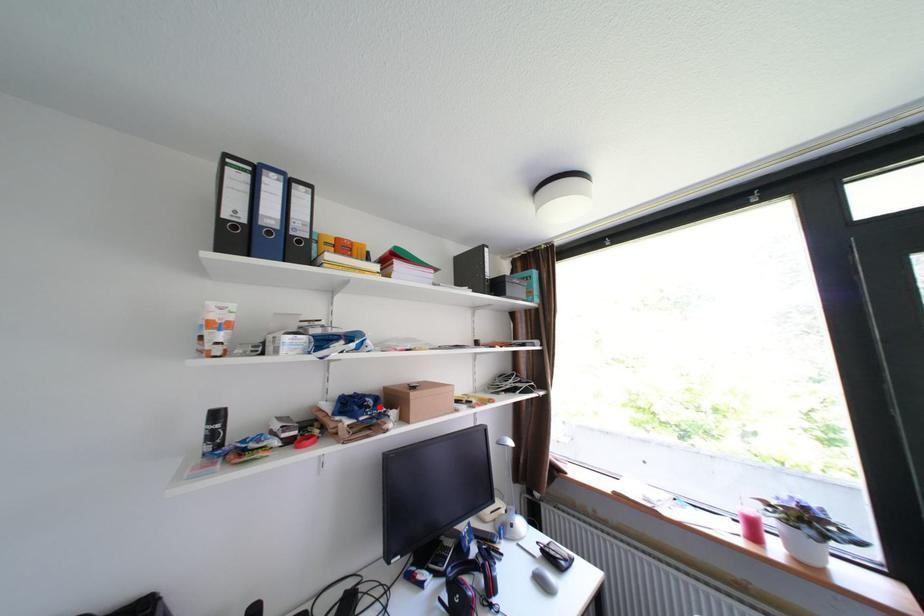
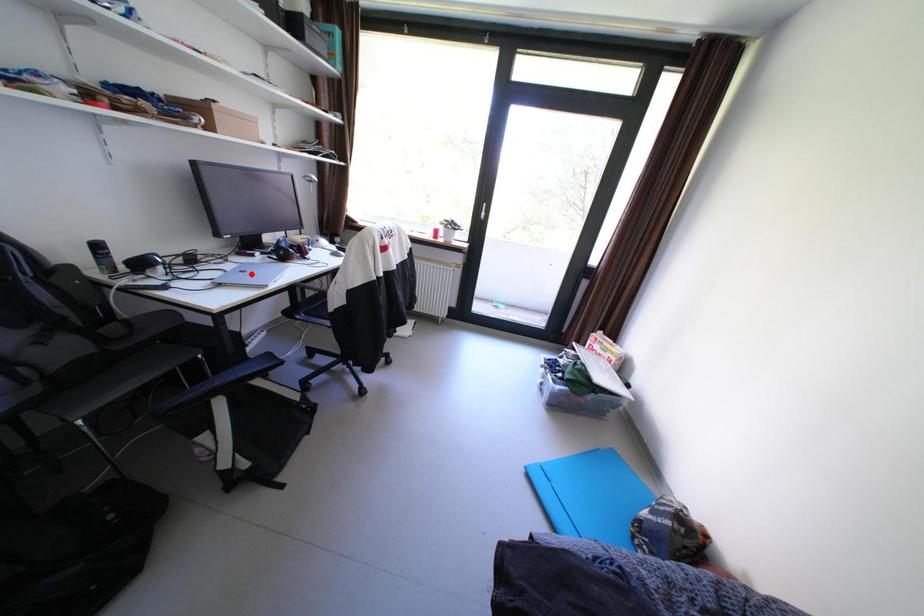
I am providing you with two images of the same scene from different viewpoints. A red point is marked on the first image and another point is marked on the second image. Does the point marked in image1 correspond to the same location as the one in image2?

No